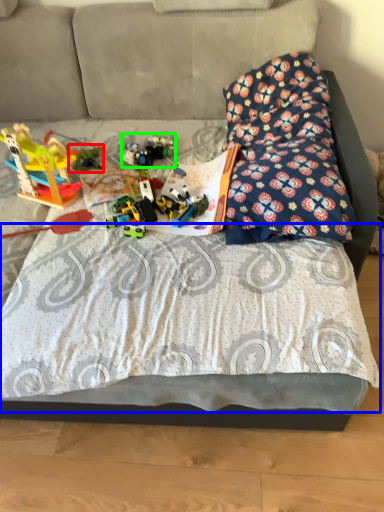
Question: Considering the real-world distances, which object is closest to toy (highlighted by a red box)? sheet (highlighted by a blue box) or toy (highlighted by a green box).

Choices:
 (A) sheet
 (B) toy

Answer: (B)